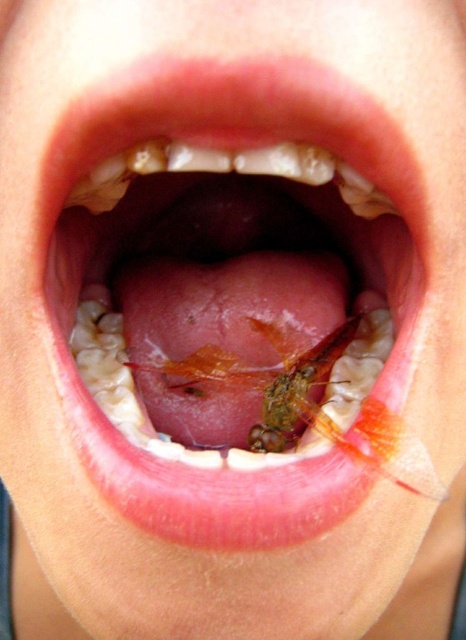
Who is higher up, pink flesh tongue at center or translucent orange insect at center?

pink flesh tongue at center is above.

Between pink flesh tongue at center and translucent orange insect at center, which one has less height?

translucent orange insect at center

Identify the location of pink flesh tongue at center. This screenshot has height=640, width=466. (164, 205).

This screenshot has width=466, height=640. Identify the location of pink flesh tongue at center. (164, 205).